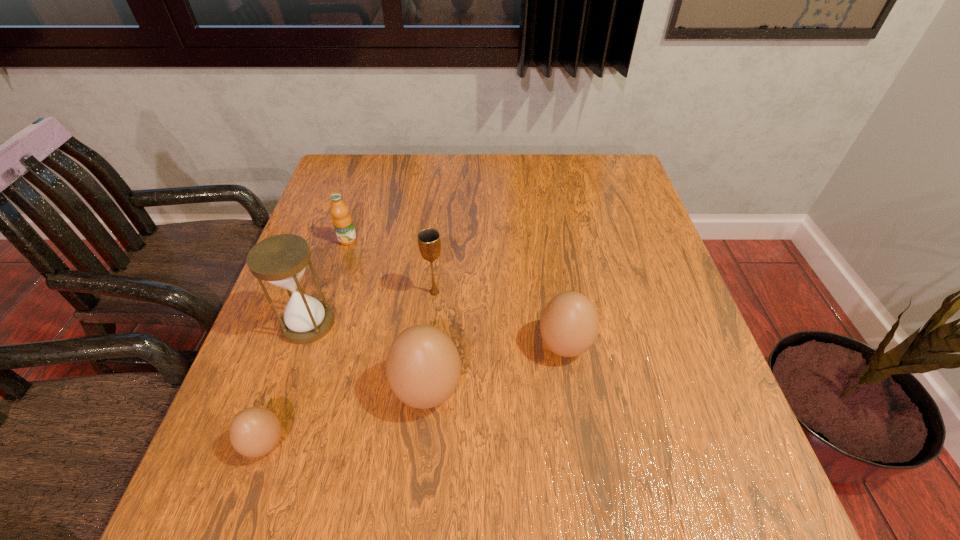
Find the location of `vacant area at the left edge`. vacant area at the left edge is located at coordinates (291, 347).

The image size is (960, 540). Identify the location of vacant space at the right edge. (647, 338).

Where is `vacant position at the far right corner of the desktop`? This screenshot has width=960, height=540. vacant position at the far right corner of the desktop is located at coordinates (622, 172).

Locate an element on the screen. free point at the near right corner is located at coordinates [x=723, y=419].

The image size is (960, 540). Find the location of `free spot between the fifth nearest object and the hourglass`. free spot between the fifth nearest object and the hourglass is located at coordinates (372, 308).

Locate an element on the screen. free spot between the hourglass and the leftmost boiled egg is located at coordinates (287, 384).

Locate an element on the screen. vacant point located between the second boiled egg from left to right and the rightmost boiled egg is located at coordinates (496, 368).

Image resolution: width=960 pixels, height=540 pixels. Find the location of `unoccupied area between the second farthest object and the orange juice`. unoccupied area between the second farthest object and the orange juice is located at coordinates (391, 266).

Where is `empty space between the second farthest object and the rightmost object`? Image resolution: width=960 pixels, height=540 pixels. empty space between the second farthest object and the rightmost object is located at coordinates click(499, 319).

At what (x,y) coordinates should I click in order to perform the action: click on vacant region between the second boiled egg from right to left and the shortest boiled egg. Please return your answer as a coordinate pair (x, y). The width and height of the screenshot is (960, 540). Looking at the image, I should click on (347, 417).